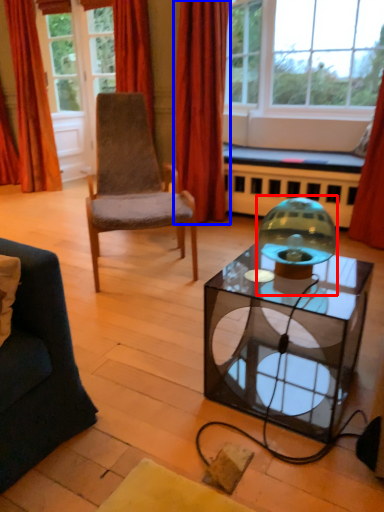
Question: Which of the following is the farthest to the observer, candle holder (highlighted by a red box) or curtain (highlighted by a blue box)?

Choices:
 (A) candle holder
 (B) curtain

Answer: (B)